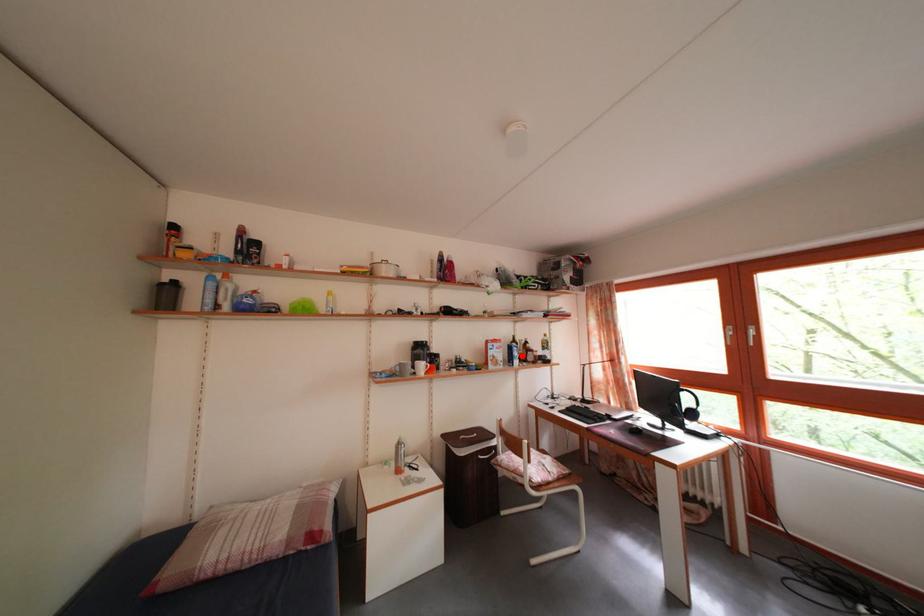
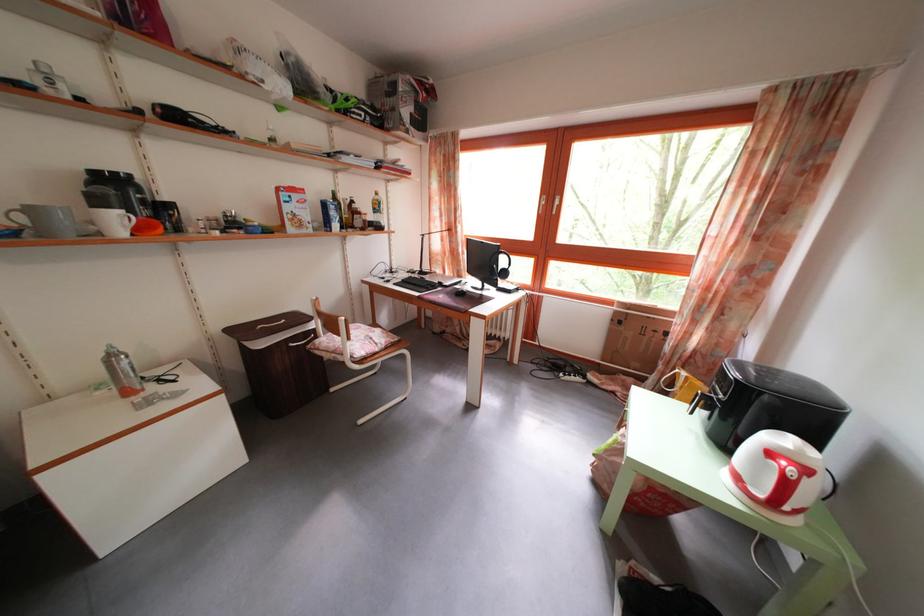
Locate, in the second image, the point that corresponds to the highlighted location in the first image.

(338, 214)